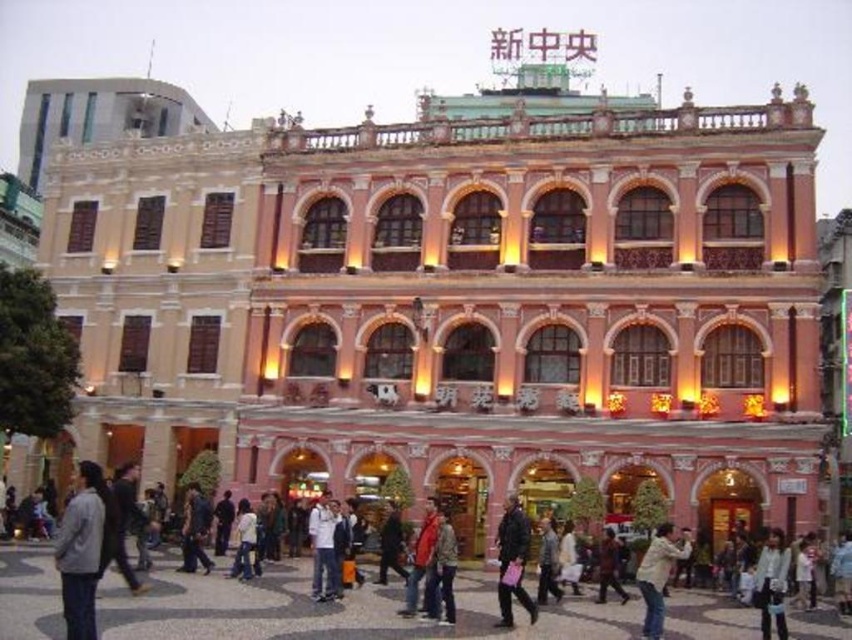
Question: Which point is closer to the camera?

Choices:
 (A) white cotton shirt at center
 (B) gray fabric jacket at lower left

Answer: (B)

Question: Which point is closer to the camera?

Choices:
 (A) gray fabric jacket at lower left
 (B) brown leather jacket at center

Answer: (A)

Question: Considering the relative positions of dark blue leather jacket at center and white cotton shirt at center in the image provided, where is dark blue leather jacket at center located with respect to white cotton shirt at center?

Choices:
 (A) right
 (B) left

Answer: (A)

Question: Is dark blue leather jacket at center to the left of white cotton shirt at center from the viewer's perspective?

Choices:
 (A) no
 (B) yes

Answer: (A)

Question: Is dark blue leather jacket at center further to camera compared to white cotton shirt at center?

Choices:
 (A) yes
 (B) no

Answer: (B)

Question: Which object is positioned closest to the light beige jacket at lower right?

Choices:
 (A) gray fabric jacket at lower left
 (B) brown leather jacket at center
 (C) white cotton shirt at center
 (D) white matte jacket at lower right

Answer: (D)